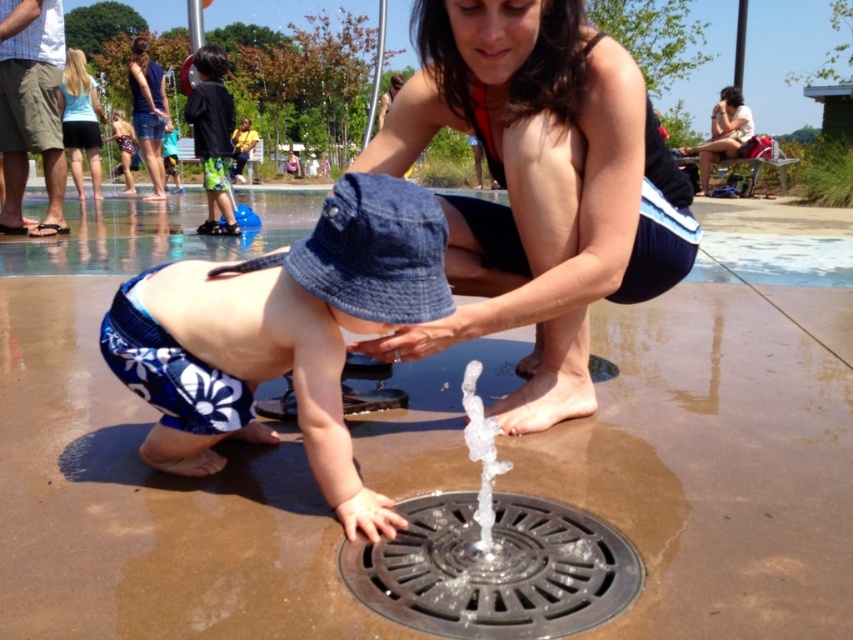
Question: Can you confirm if black metal drain at center is positioned to the right of denim shorts at upper left?

Choices:
 (A) no
 (B) yes

Answer: (B)

Question: Is blue floral swim trunks at lower left wider than denim shorts at upper left?

Choices:
 (A) yes
 (B) no

Answer: (A)

Question: Does matte black swimsuit at center have a lesser width compared to blue floral swim trunks at lower left?

Choices:
 (A) no
 (B) yes

Answer: (A)

Question: Among these objects, which one is nearest to the camera?

Choices:
 (A) blue floral swim trunks at lower left
 (B) black metal drain at center
 (C) matte black swimsuit at center
 (D) denim shorts at upper left

Answer: (B)

Question: Which is nearer to the black metal drain at center?

Choices:
 (A) denim shorts at upper left
 (B) blue floral swim trunks at lower left
 (C) matte black swimsuit at center

Answer: (B)

Question: Which object is the farthest from the blue floral swim trunks at lower left?

Choices:
 (A) matte black swimsuit at center
 (B) black metal drain at center

Answer: (A)